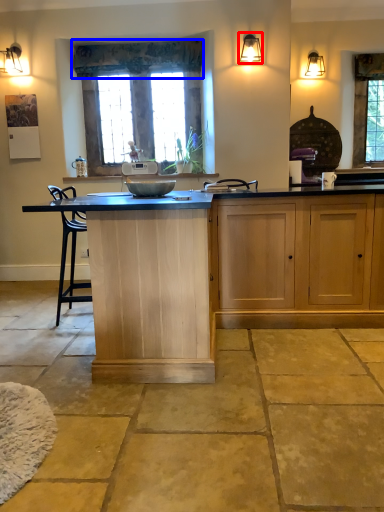
Question: Which of the following is the farthest to the observer, light fixture (highlighted by a red box) or curtain (highlighted by a blue box)?

Choices:
 (A) light fixture
 (B) curtain

Answer: (B)